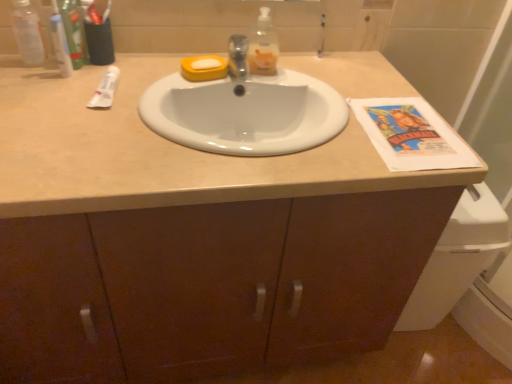
I want to click on free area in between white matte tube at upper left and transparent plastic bottle at upper left, the first bottle in the left-to-right sequence, so click(x=66, y=81).